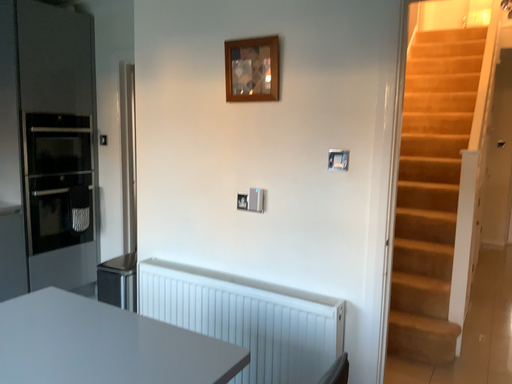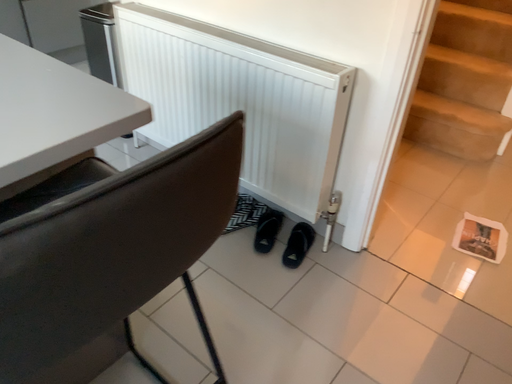
Question: How did the camera likely rotate when shooting the video?

Choices:
 (A) rotated upward
 (B) rotated downward

Answer: (B)